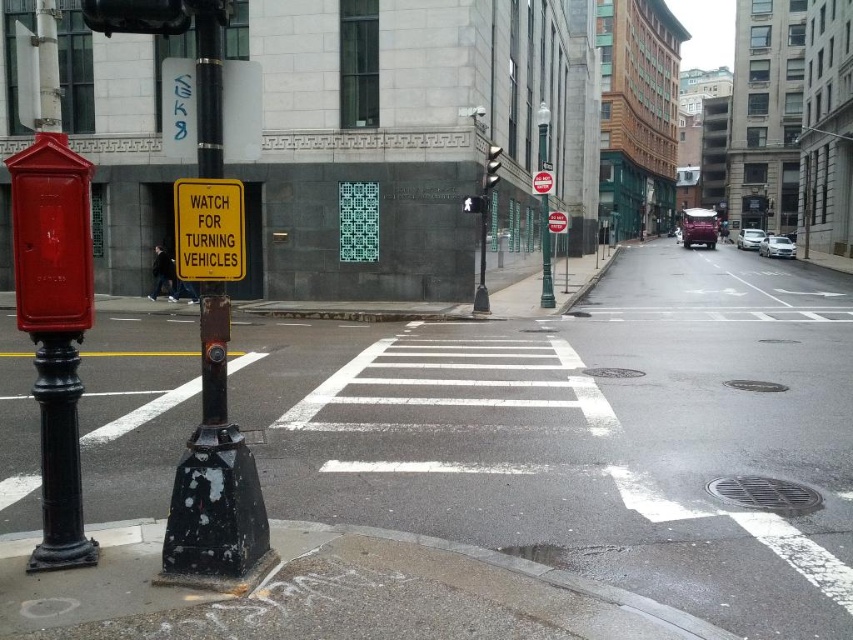
Looking at this image, which is more to the right, metallic reflective sign at center or metallic at center?

From the viewer's perspective, metallic reflective sign at center appears more on the right side.

Between metallic reflective sign at center and metallic at center, which one is positioned lower?

metallic at center is below.

Where is `metallic reflective sign at center`? The image size is (853, 640). metallic reflective sign at center is located at coordinates (543, 182).

You are a GUI agent. You are given a task and a screenshot of the screen. Output one action in this format:
    pyautogui.click(x=<x>, y=<y>)
    Task: Click on the metallic reflective sign at center
    Image resolution: width=853 pixels, height=640 pixels.
    Given the screenshot: What is the action you would take?
    click(x=543, y=182)

In the scene shown: Is green metallic pole at center to the left of metallic rectangular sign at center from the viewer's perspective?

Incorrect, green metallic pole at center is not on the left side of metallic rectangular sign at center.

Is green metallic pole at center closer to camera compared to metallic rectangular sign at center?

Yes, it is.

Which is in front, point (548, 109) or point (561, 214)?

Positioned in front is point (561, 214).

Where is `green metallic pole at center`? The width and height of the screenshot is (853, 640). green metallic pole at center is located at coordinates (544, 253).

Is yellow plastic sign at center to the right of metallic traffic light at center from the viewer's perspective?

No, yellow plastic sign at center is not to the right of metallic traffic light at center.

Which is behind, point (183, 269) or point (498, 168)?

The point (498, 168) is more distant.

Locate an element on the screen. The image size is (853, 640). yellow plastic sign at center is located at coordinates (207, 228).